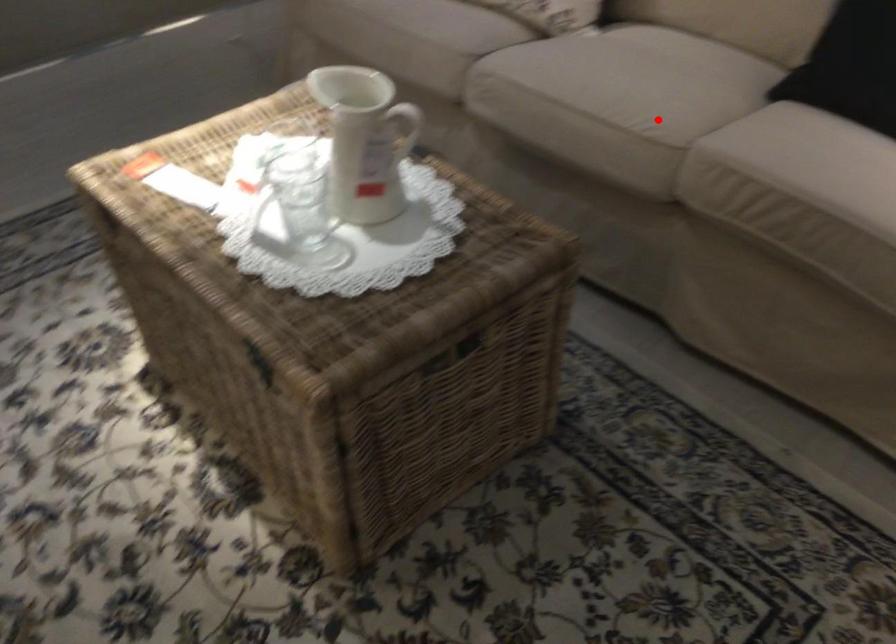
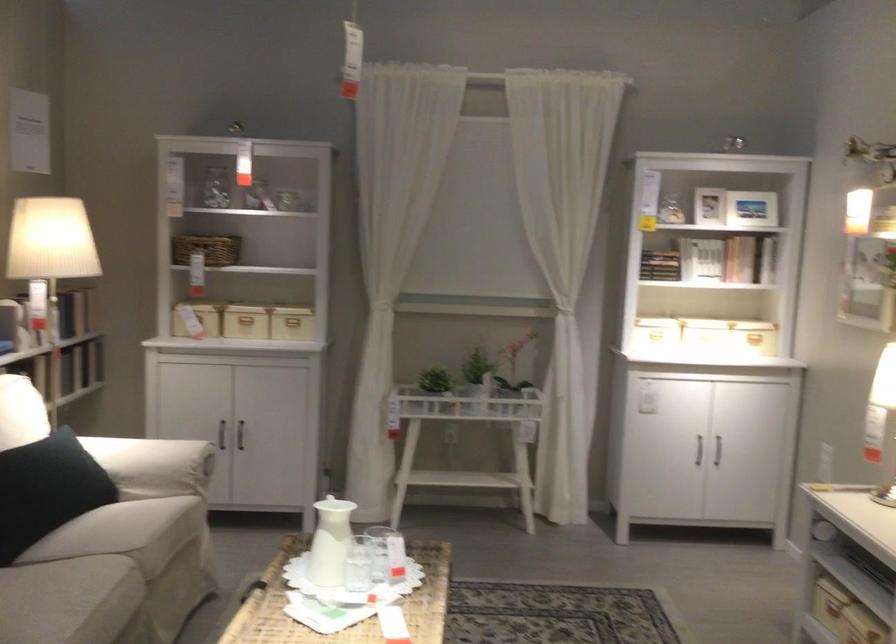
In the second image, find the point that corresponds to the highlighted location in the first image.

(110, 576)